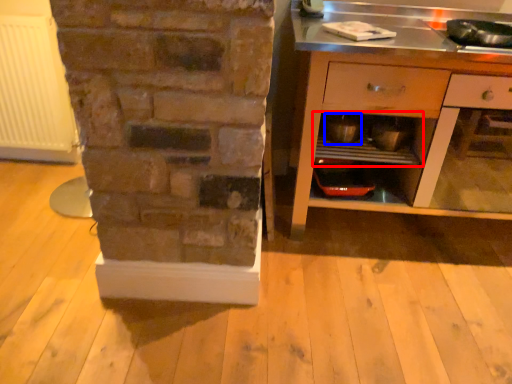
Question: Among these objects, which one is farthest to the camera, shelf (highlighted by a red box) or appliance (highlighted by a blue box)?

Choices:
 (A) shelf
 (B) appliance

Answer: (B)